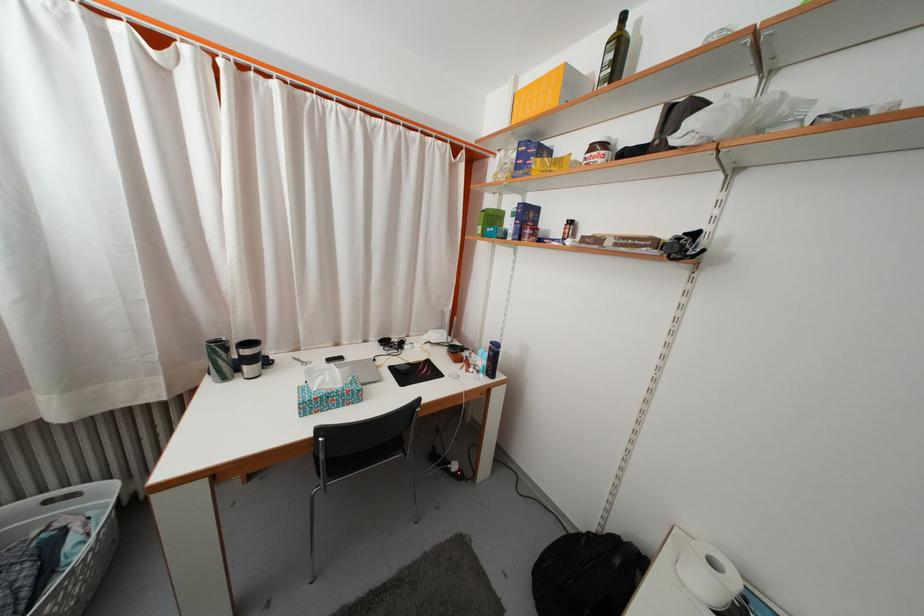
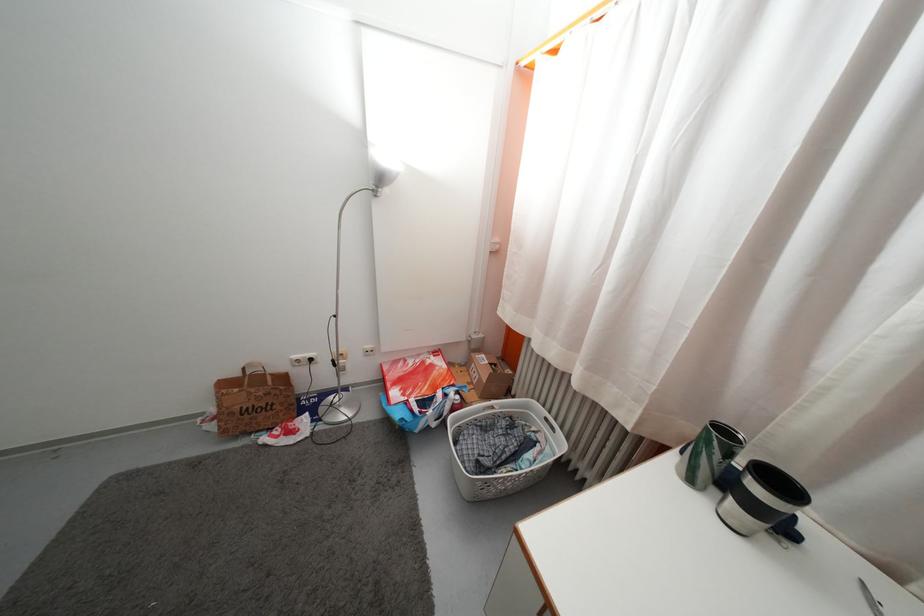
The point at (231, 386) is marked in the first image. Where is the corresponding point in the second image?

(697, 488)